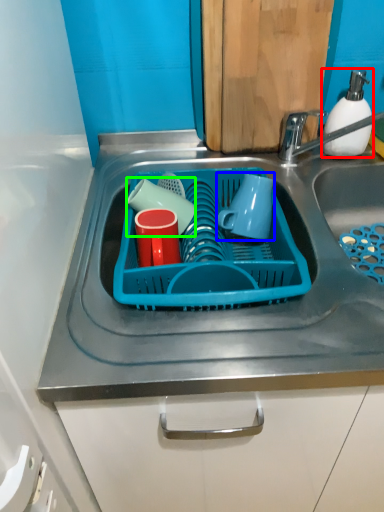
Question: Which object is the closest to the soap dispenser (highlighted by a red box)? Choose among these: mug (highlighted by a blue box) or tableware (highlighted by a green box).

Choices:
 (A) mug
 (B) tableware

Answer: (A)